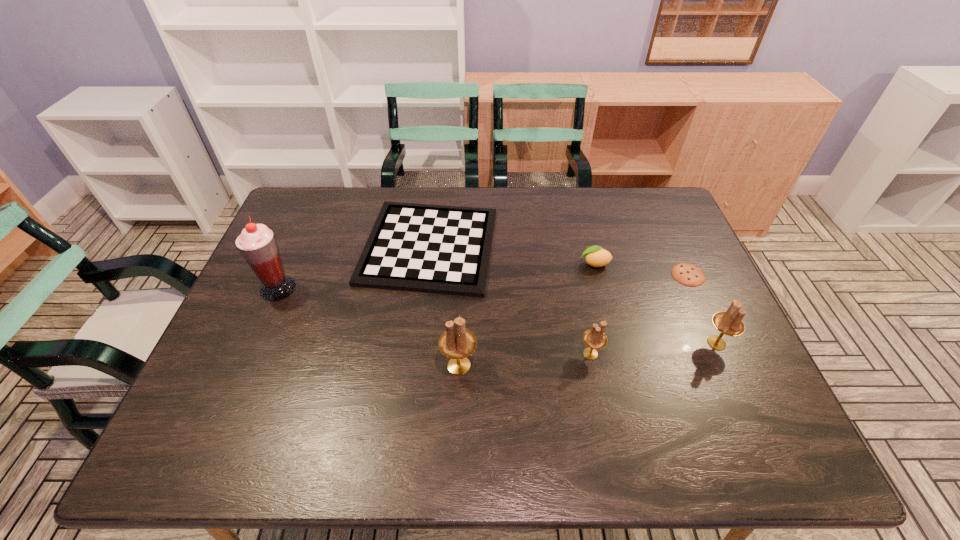
Identify the location of free space located on the left of the second candle holder from left to right. (426, 354).

The height and width of the screenshot is (540, 960). Identify the location of free space located 0.240m on the back of the second shortest candle holder. (682, 266).

What are the coordinates of `vacant space located 0.200m on the front of the second shortest object` in the screenshot? It's located at (416, 358).

Find the location of a particular element. This screenshot has width=960, height=540. blank space located 0.130m with leaves positioned above the lemon is located at coordinates (535, 264).

In order to click on free space located 0.120m with leaves positioned above the lemon in this screenshot , I will do `click(539, 264)`.

Find the location of `vacant space located with leaves positioned above the lemon`. vacant space located with leaves positioned above the lemon is located at coordinates click(552, 264).

Identify the location of vacant space located 0.120m on the back of the cookie. The image size is (960, 540). (671, 237).

Find the location of `free space located 0.140m on the back of the leftmost object`. free space located 0.140m on the back of the leftmost object is located at coordinates (298, 244).

This screenshot has width=960, height=540. Find the location of `object situated at the far edge`. object situated at the far edge is located at coordinates (440, 249).

Locate an element on the screen. The height and width of the screenshot is (540, 960). object located at the near edge is located at coordinates (457, 342).